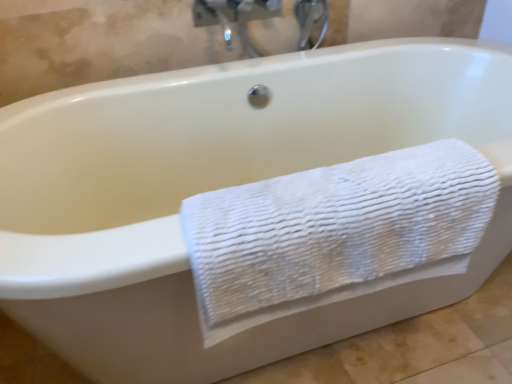
Identify the location of vacant area on top of white textured towel at lower right (from a real-world perspective). This screenshot has height=384, width=512. (306, 190).